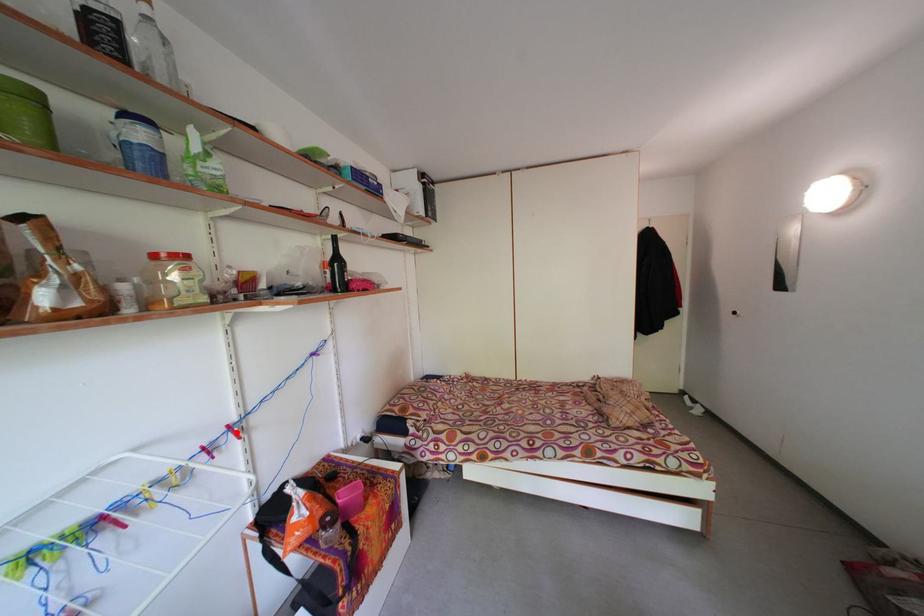
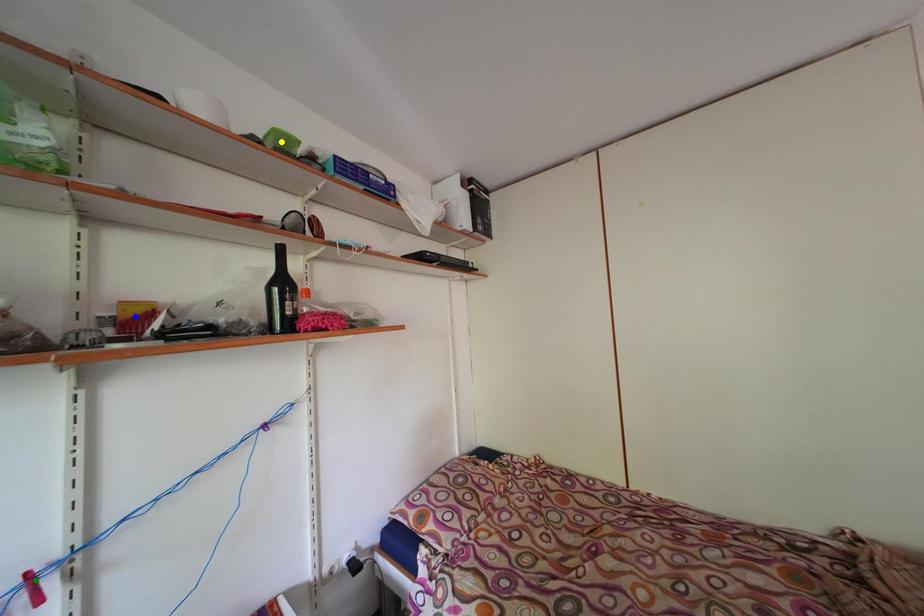
Question: I am providing you with two images of the same scene from different viewpoints. A red point is marked on the first image. You are given multiple points on the second image. In image 2, which mark is for the same physical point as the one in image 1?

Choices:
 (A) blue point
 (B) yellow point
 (C) green point

Answer: (C)